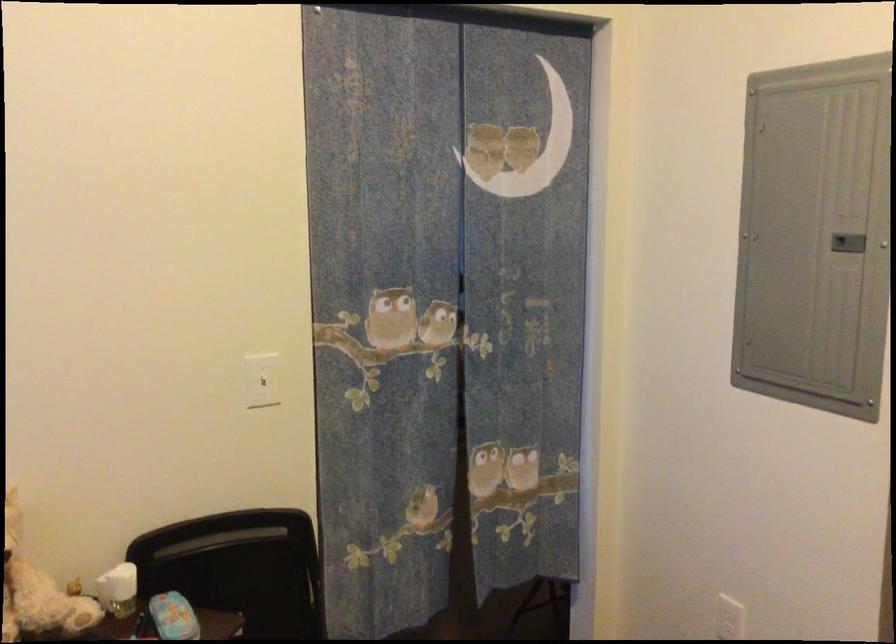
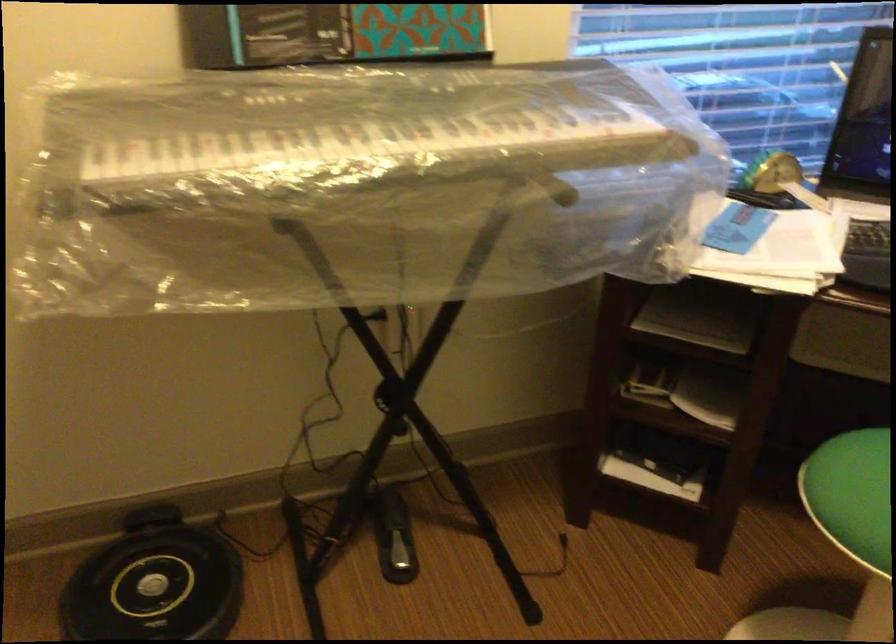
First-person continuous shooting, in which direction is the camera rotating?

The camera rotated toward left-down.